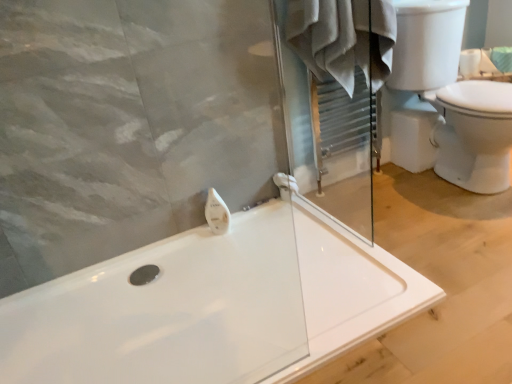
Question: Is white plastic towel bar at center surrounded by white cotton bathrobe at upper center?

Choices:
 (A) no
 (B) yes

Answer: (A)

Question: Is white cotton bathrobe at upper center positioned in front of white plastic towel bar at center?

Choices:
 (A) no
 (B) yes

Answer: (B)

Question: Does white cotton bathrobe at upper center have a greater height compared to white plastic towel bar at center?

Choices:
 (A) yes
 (B) no

Answer: (A)

Question: Could you tell me if white cotton bathrobe at upper center is turned towards white plastic towel bar at center?

Choices:
 (A) yes
 (B) no

Answer: (B)

Question: From the image's perspective, does white cotton bathrobe at upper center appear higher than white plastic towel bar at center?

Choices:
 (A) no
 (B) yes

Answer: (B)

Question: Considering the relative positions of white glossy bathtub at center and white plastic towel bar at center in the image provided, is white glossy bathtub at center to the left or to the right of white plastic towel bar at center?

Choices:
 (A) left
 (B) right

Answer: (B)

Question: Choose the correct answer: Is white glossy bathtub at center inside white plastic towel bar at center or outside it?

Choices:
 (A) outside
 (B) inside

Answer: (A)

Question: In the image, is white glossy bathtub at center positioned in front of or behind white plastic towel bar at center?

Choices:
 (A) behind
 (B) front

Answer: (B)

Question: Is point (159, 289) positioned closer to the camera than point (282, 190)?

Choices:
 (A) farther
 (B) closer

Answer: (B)

Question: Considering the positions of white glossy soap dispenser at upper center and white plastic towel bar at center in the image, is white glossy soap dispenser at upper center taller or shorter than white plastic towel bar at center?

Choices:
 (A) tall
 (B) short

Answer: (A)

Question: From the image's perspective, is white glossy soap dispenser at upper center above or below white plastic towel bar at center?

Choices:
 (A) below
 (B) above

Answer: (A)

Question: Is white glossy soap dispenser at upper center inside or outside of white plastic towel bar at center?

Choices:
 (A) inside
 (B) outside

Answer: (B)

Question: Visually, is white glossy soap dispenser at upper center positioned to the left or to the right of white plastic towel bar at center?

Choices:
 (A) left
 (B) right

Answer: (A)

Question: From the image's perspective, is white glossy soap dispenser at upper center above or below white glossy toilet at right?

Choices:
 (A) above
 (B) below

Answer: (B)

Question: From a real-world perspective, is white glossy soap dispenser at upper center above or below white glossy toilet at right?

Choices:
 (A) below
 (B) above

Answer: (A)